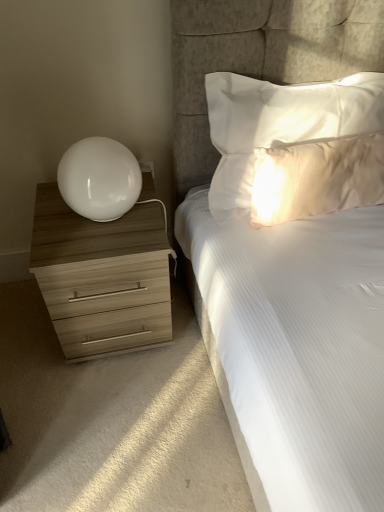
Question: Can you confirm if satin white pillow at upper right, which ranks as the first pillow in bottom-to-top order, is positioned to the right of wooden chest of drawers at left?

Choices:
 (A) yes
 (B) no

Answer: (A)

Question: Does satin white pillow at upper right, which ranks as the first pillow in bottom-to-top order, have a larger size compared to wooden chest of drawers at left?

Choices:
 (A) no
 (B) yes

Answer: (A)

Question: Is satin white pillow at upper right, which ranks as the first pillow in bottom-to-top order, thinner than wooden chest of drawers at left?

Choices:
 (A) no
 (B) yes

Answer: (B)

Question: From the image's perspective, is satin white pillow at upper right, which ranks as the 2th pillow in top-to-bottom order, on wooden chest of drawers at left?

Choices:
 (A) yes
 (B) no

Answer: (A)

Question: Is satin white pillow at upper right, which ranks as the first pillow in bottom-to-top order, positioned far away from wooden chest of drawers at left?

Choices:
 (A) no
 (B) yes

Answer: (A)

Question: From the image's perspective, does satin white pillow at upper right, which ranks as the first pillow in bottom-to-top order, appear lower than wooden chest of drawers at left?

Choices:
 (A) no
 (B) yes

Answer: (A)

Question: Considering the relative sizes of satin white pillow at upper right, which ranks as the 2th pillow in top-to-bottom order, and white satin pillow at upper right, the first pillow in the top-to-bottom sequence, in the image provided, is satin white pillow at upper right, which ranks as the 2th pillow in top-to-bottom order, shorter than white satin pillow at upper right, the first pillow in the top-to-bottom sequence,?

Choices:
 (A) yes
 (B) no

Answer: (A)

Question: From a real-world perspective, does satin white pillow at upper right, which ranks as the first pillow in bottom-to-top order, stand above white satin pillow at upper right, the second pillow ordered from the bottom?

Choices:
 (A) no
 (B) yes

Answer: (A)

Question: Is satin white pillow at upper right, which ranks as the 2th pillow in top-to-bottom order, thinner than white satin pillow at upper right, the first pillow in the top-to-bottom sequence?

Choices:
 (A) no
 (B) yes

Answer: (B)

Question: From a real-world perspective, does satin white pillow at upper right, which ranks as the 2th pillow in top-to-bottom order, sit lower than white satin pillow at upper right, the first pillow in the top-to-bottom sequence?

Choices:
 (A) yes
 (B) no

Answer: (A)

Question: Is satin white pillow at upper right, which ranks as the first pillow in bottom-to-top order, wider than white satin pillow at upper right, the second pillow ordered from the bottom?

Choices:
 (A) no
 (B) yes

Answer: (A)

Question: Is satin white pillow at upper right, which ranks as the first pillow in bottom-to-top order, facing away from white satin pillow at upper right, the second pillow ordered from the bottom?

Choices:
 (A) yes
 (B) no

Answer: (A)

Question: Is white glossy table lamp at left to the left of wooden chest of drawers at left from the viewer's perspective?

Choices:
 (A) yes
 (B) no

Answer: (B)